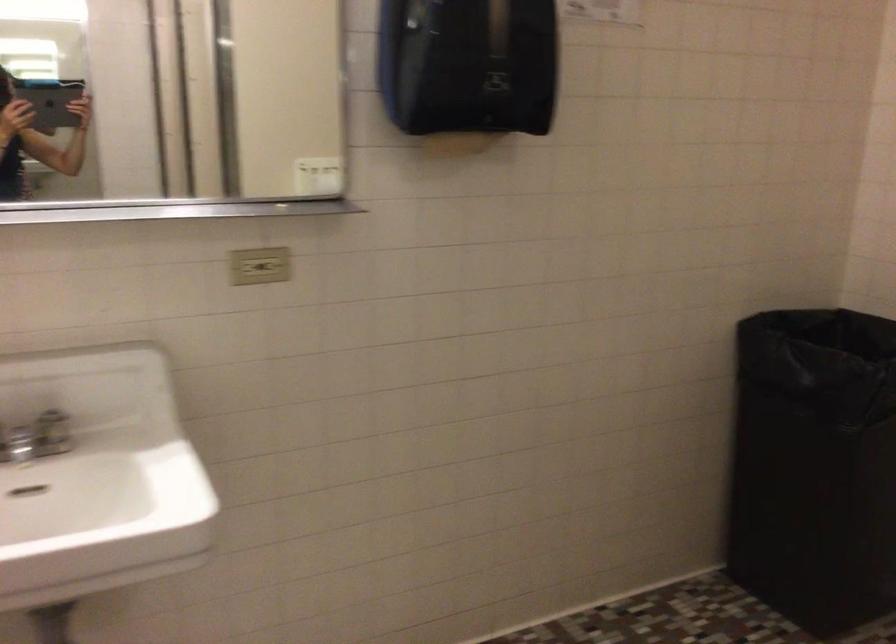
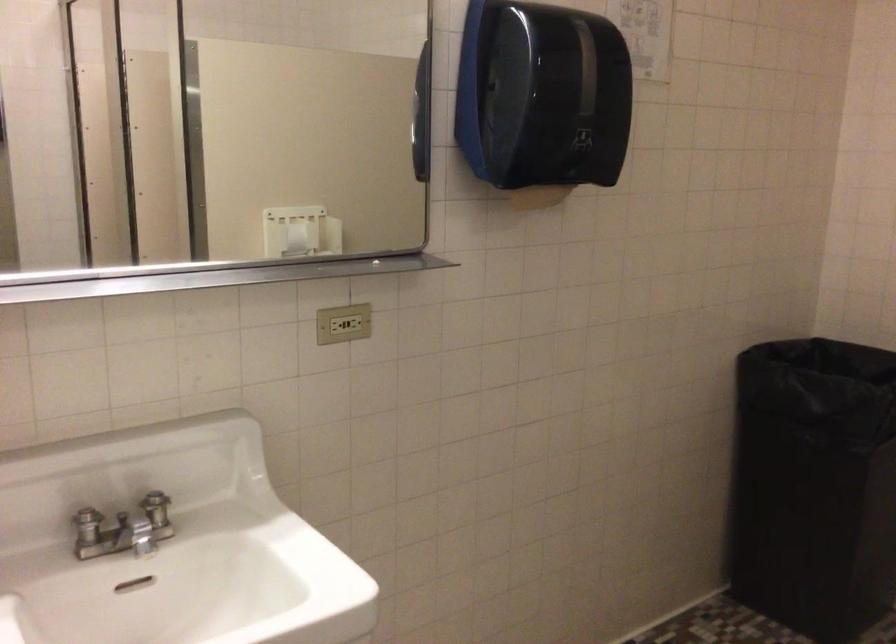
In the second image, find the point that corresponds to point 263,266 in the first image.

(342, 323)